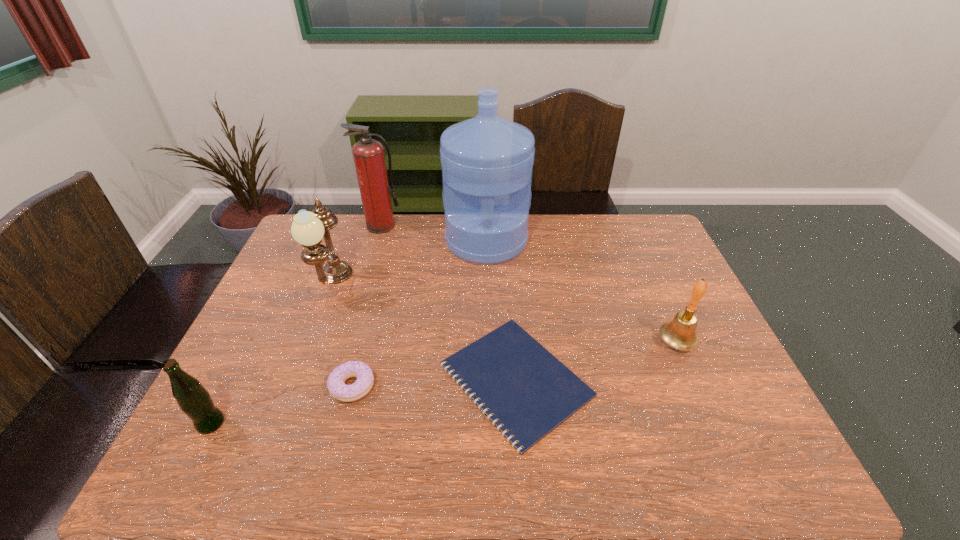
Identify the location of the tallest object. The image size is (960, 540). (487, 161).

Where is `fire extinguisher`? The width and height of the screenshot is (960, 540). fire extinguisher is located at coordinates (368, 154).

The height and width of the screenshot is (540, 960). Find the location of `the third tallest object`. the third tallest object is located at coordinates (308, 228).

Where is `the rightmost object`? the rightmost object is located at coordinates (680, 333).

I want to click on beer bottle, so click(x=194, y=400).

At what (x,y) coordinates should I click in order to perform the action: click on the second shortest object. Please return your answer as a coordinate pair (x, y). Looking at the image, I should click on [338, 389].

Locate an element on the screen. notepad is located at coordinates (529, 391).

Where is `vacant space located on the side of the water jug with the handle`? This screenshot has height=540, width=960. vacant space located on the side of the water jug with the handle is located at coordinates (487, 281).

Locate an element on the screen. This screenshot has width=960, height=540. vacant space situated at the nozzle of the second tallest object is located at coordinates (365, 282).

Locate an element on the screen. free space located 0.180m on the right of the third tallest object is located at coordinates (406, 285).